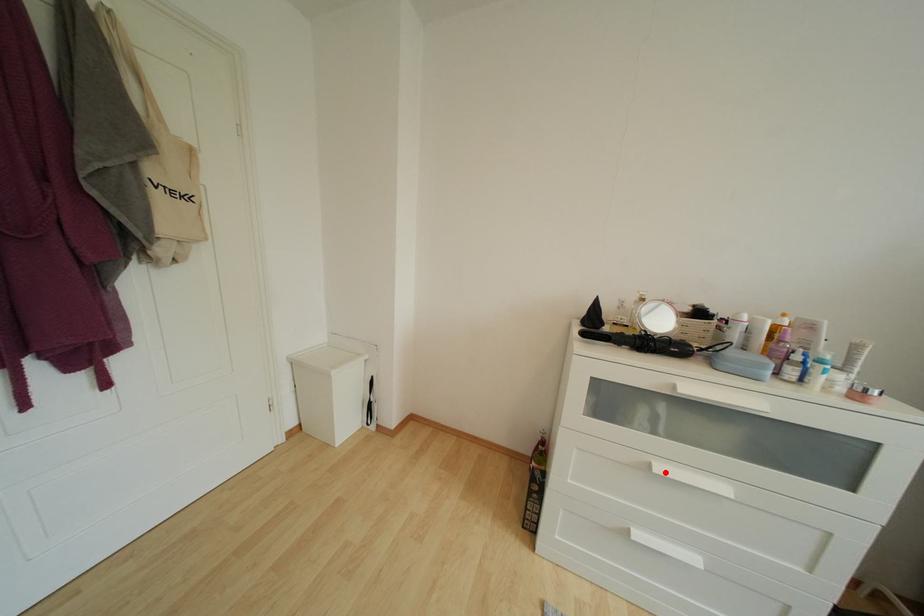
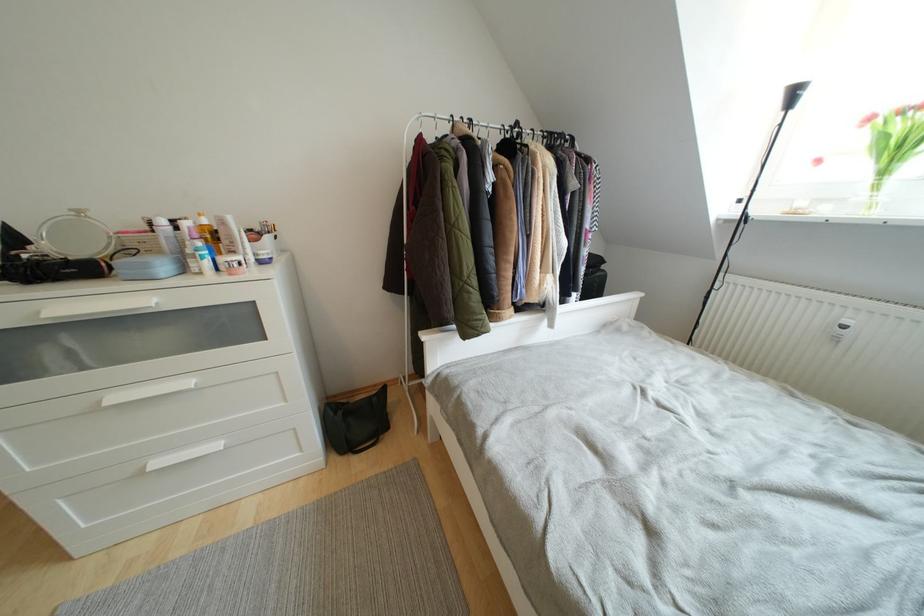
Find the pixel in the second image that matches the highlighted location in the first image.

(120, 402)